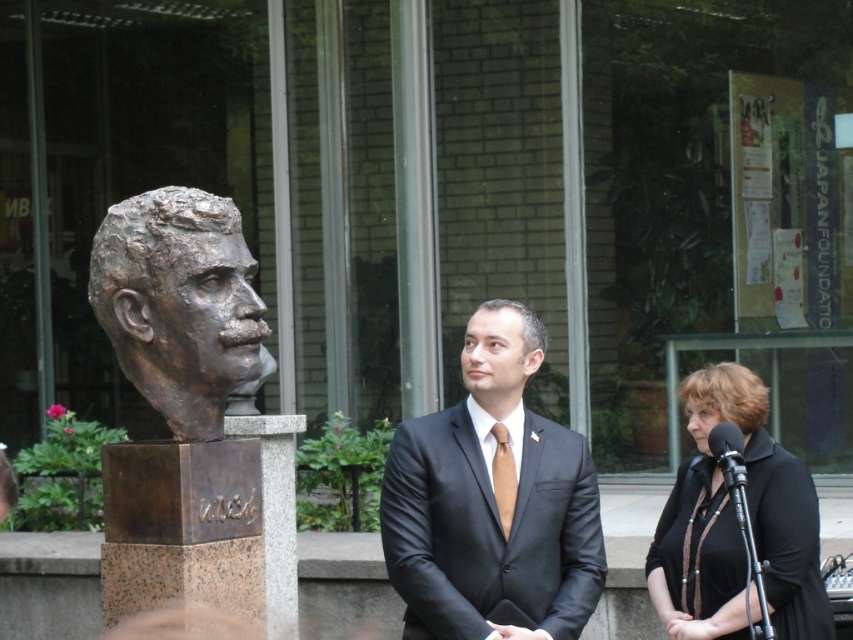
Question: Which object is the closest to the shiny bronze bust at center?

Choices:
 (A) shiny black suit at center
 (B) dark brown hair at center
 (C) matte brown tie at center

Answer: (C)

Question: Is bronze sculpture at left to the left of shiny bronze bust at center from the viewer's perspective?

Choices:
 (A) no
 (B) yes

Answer: (B)

Question: Does shiny bronze bust at center come in front of matte brown tie at center?

Choices:
 (A) no
 (B) yes

Answer: (A)

Question: Among these objects, which one is nearest to the camera?

Choices:
 (A) dark brown hair at center
 (B) black matte jacket at lower right
 (C) shiny black suit at center

Answer: (C)

Question: Which object is closer to the camera taking this photo?

Choices:
 (A) dark brown hair at center
 (B) black matte jacket at lower right

Answer: (B)

Question: Is black matte jacket at lower right wider than dark brown hair at center?

Choices:
 (A) yes
 (B) no

Answer: (A)